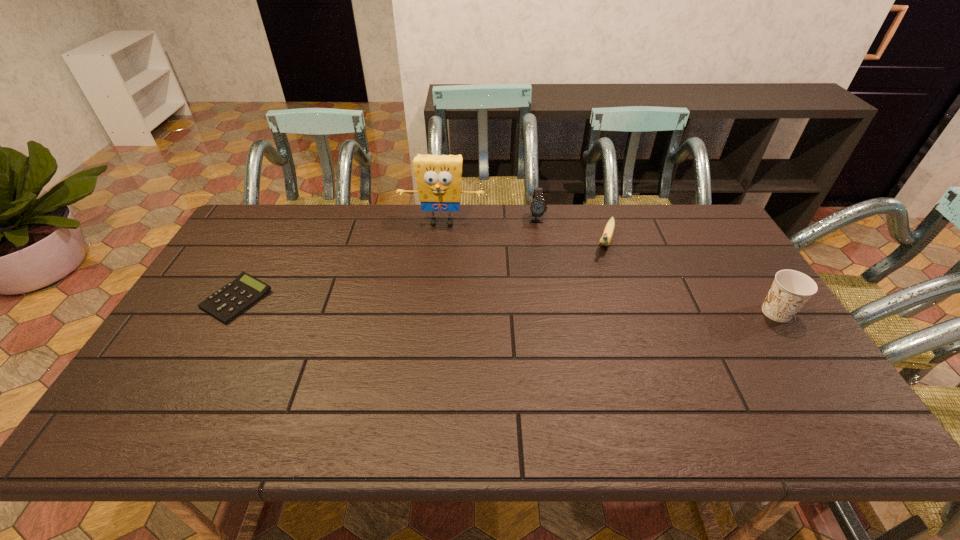
Locate an element on the screen. The width and height of the screenshot is (960, 540). free space that satisfies the following two spatial constraints: 1. on the front side of the Dixie cup; 2. on the right side of the second object from right to left is located at coordinates (629, 313).

Find the location of `free location that satisfies the following two spatial constraints: 1. on the front side of the fourth tallest object; 2. on the right side of the Dixie cup`. free location that satisfies the following two spatial constraints: 1. on the front side of the fourth tallest object; 2. on the right side of the Dixie cup is located at coordinates (629, 313).

Identify the location of free spot that satisfies the following two spatial constraints: 1. on the front side of the second object from right to left; 2. on the left side of the Dixie cup. The height and width of the screenshot is (540, 960). (629, 313).